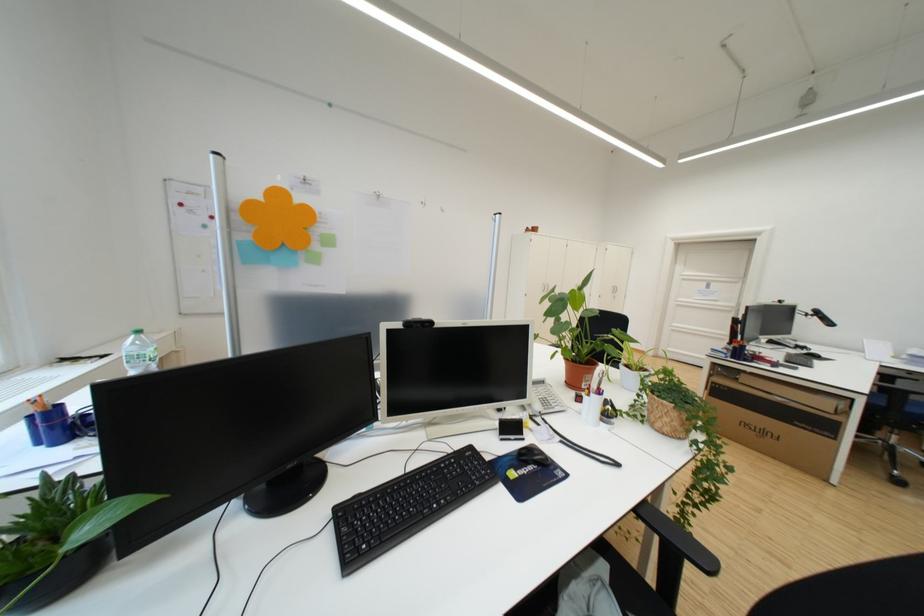
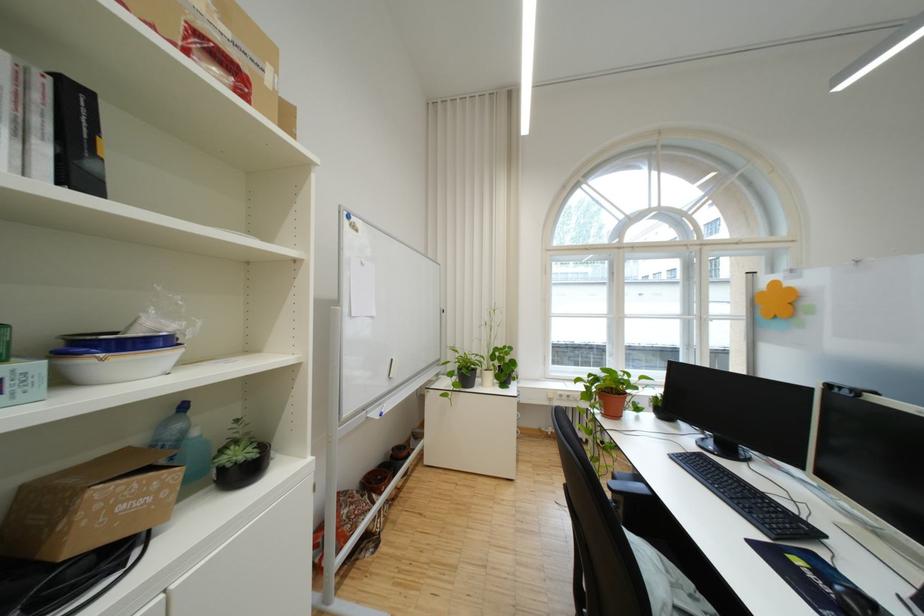
Question: I am providing you with two images of the same scene from different viewpoints. Which of the following objects are not visible in image2?

Choices:
 (A) white and blue bowl
 (B) small potted plant
 (C) yellow pipe valve
 (D) blue pen holder

Answer: (D)